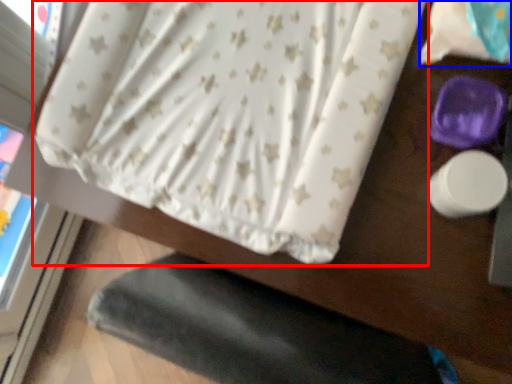
Question: Which point is closer to the camera, curtain (highlighted by a red box) or sheet (highlighted by a blue box)?

Choices:
 (A) curtain
 (B) sheet

Answer: (B)